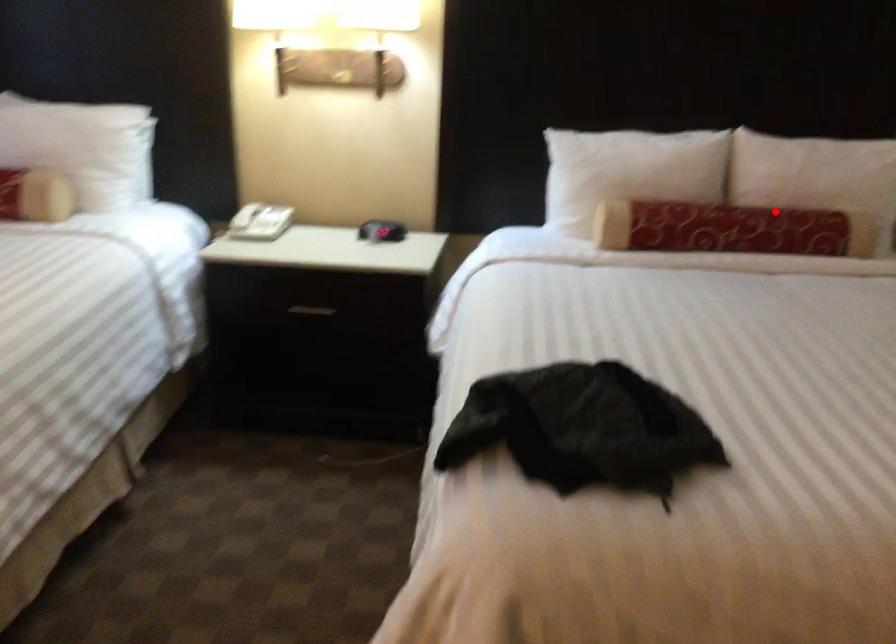
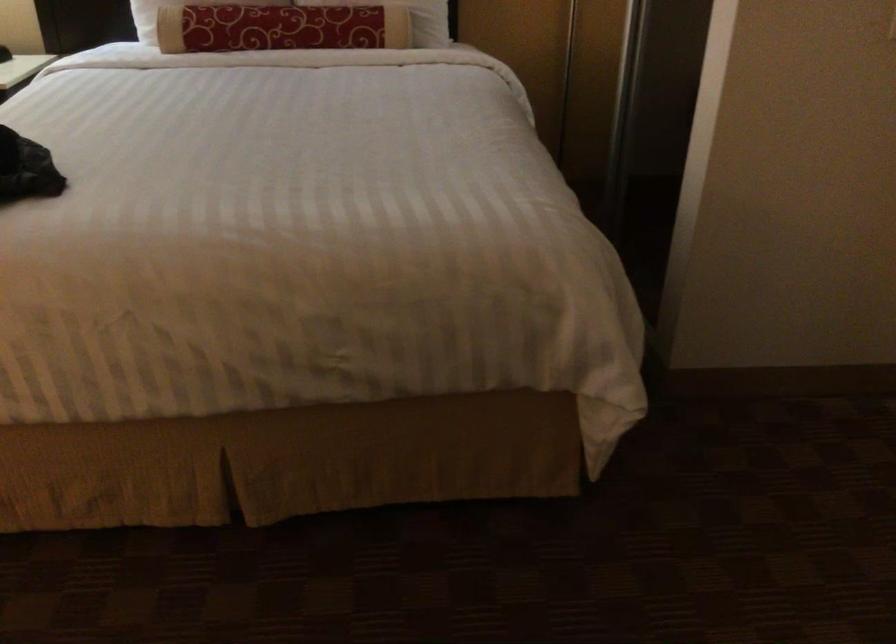
Question: A red point is marked in image1. In image2, is the corresponding 3D point closer to the camera or farther? Reply with the corresponding letter.

Choices:
 (A) The corresponding 3D point is closer.
 (B) The corresponding 3D point is farther.

Answer: (B)